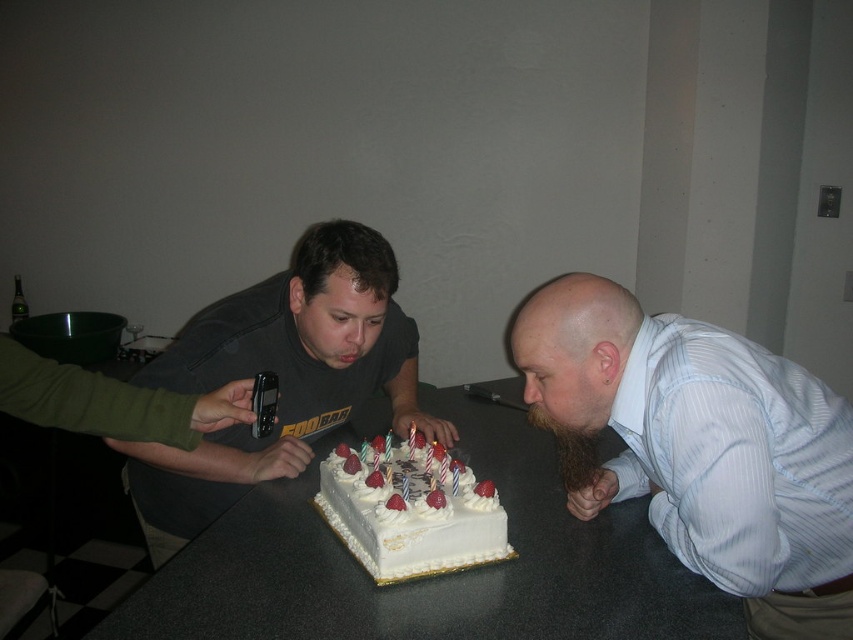
You are planning to place a small gift box on the table where the dark gray T shirt at center is located. The gift box requires 10 cm of space. Is there enough space at point (280, 376) to place it?

The point (280, 376) is where the dark gray T shirt at center is located. Since the gift box requires 10 cm of space, but the description does not provide information about the available space at that point, it is unclear if there is enough room. Please check the actual dimensions of the table and the surrounding objects to ensure the gift box fits comfortably.

Based on the scene description, where is the light blue striped shirt at lower right located in terms of its 2D coordinates?

The light blue striped shirt at lower right is located at the 2D coordinates of point (700, 448).

You are a photographer standing in the room. You want to take a photo of the white glossy table at center and the light blue striped shirt at lower right. Which object should you focus on first to ensure both are in focus?

The light blue striped shirt at lower right is closer to the viewer than the white glossy table at center, so you should focus on the light blue striped shirt at lower right first to ensure both are in focus.